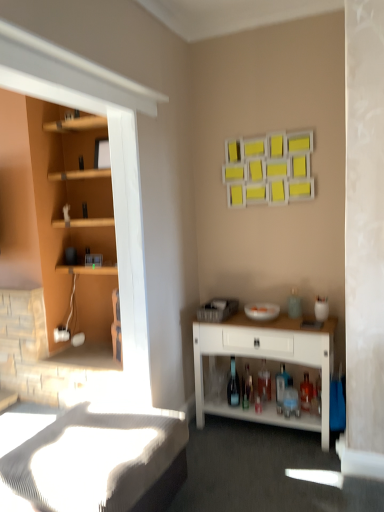
Describe the element at coordinates (99, 461) in the screenshot. I see `white textured bed frame at lower left` at that location.

The width and height of the screenshot is (384, 512). I want to click on white wood desk at lower right, so click(267, 359).

From the picture: Measure the distance between translucent glass bottle at lower center, the second bottle positioned from the left, and camera.

translucent glass bottle at lower center, the second bottle positioned from the left, is 9.23 feet away from camera.

You are a GUI agent. You are given a task and a screenshot of the screen. Output one action in this format:
    pyautogui.click(x=<x>, y=<y>)
    Task: Click on the transparent glass bottle at center, the 1th bottle positioned from the left
    This screenshot has width=384, height=512.
    Given the screenshot: What is the action you would take?
    pyautogui.click(x=233, y=386)

The image size is (384, 512). What do you see at coordinates (264, 383) in the screenshot?
I see `translucent glass bottle at lower center, which is the 3th bottle in left-to-right order` at bounding box center [264, 383].

What is the approximate width of translucent glass bottle at lower center, which is the 3th bottle in left-to-right order?

translucent glass bottle at lower center, which is the 3th bottle in left-to-right order, is 2.26 inches in width.

The width and height of the screenshot is (384, 512). What are the coordinates of `white textured bed frame at lower left` in the screenshot? It's located at (99, 461).

Does translucent glass bottle at lower center, the 2th bottle positioned from the right, turn towards translucent glass bottle at lower center, which is the 4th bottle in front-to-back order?

No, translucent glass bottle at lower center, the 2th bottle positioned from the right, is not oriented towards translucent glass bottle at lower center, which is the 4th bottle in front-to-back order.

Do you think translucent glass bottle at lower center, which is the second bottle from back to front, is within translucent glass bottle at lower center, which is the 4th bottle in front-to-back order, or outside of it?

translucent glass bottle at lower center, which is the second bottle from back to front, is not enclosed by translucent glass bottle at lower center, which is the 4th bottle in front-to-back order.

Is translucent glass bottle at lower center, the 2th bottle positioned from the right, not close to translucent glass bottle at lower center, placed as the 3th bottle when sorted from right to left?

No, translucent glass bottle at lower center, the 2th bottle positioned from the right, is not far away from translucent glass bottle at lower center, placed as the 3th bottle when sorted from right to left.

Is translucent glass bottle at lower center, which is the second bottle from back to front, at the right side of translucent glass bottle at lower center, placed as the 3th bottle when sorted from right to left?

Correct, you'll find translucent glass bottle at lower center, which is the second bottle from back to front, to the right of translucent glass bottle at lower center, placed as the 3th bottle when sorted from right to left.

Which object is more forward, translucent glass bottle at lower center, which is the second bottle from back to front, or translucent glass bottle at lower center, marked as the fourth bottle in a back-to-front arrangement?

translucent glass bottle at lower center, marked as the fourth bottle in a back-to-front arrangement, is in front.

From the image's perspective, is translucent glass bottle at lower center, which is the second bottle from back to front, positioned above or below translucent glass bottle at lower center, arranged as the first bottle when viewed from the right?

translucent glass bottle at lower center, which is the second bottle from back to front, is situated higher than translucent glass bottle at lower center, arranged as the first bottle when viewed from the right, in the image.

From a real-world perspective, does translucent glass bottle at lower center, which is the 3th bottle in left-to-right order, stand above translucent glass bottle at lower center, arranged as the first bottle when viewed from the right?

Correct, in the physical world, translucent glass bottle at lower center, which is the 3th bottle in left-to-right order, is higher than translucent glass bottle at lower center, arranged as the first bottle when viewed from the right.

Considering the sizes of objects translucent glass bottle at lower center, which is the second bottle from back to front, and translucent glass bottle at lower center, arranged as the first bottle when viewed from the right, in the image provided, who is wider, translucent glass bottle at lower center, which is the second bottle from back to front, or translucent glass bottle at lower center, arranged as the first bottle when viewed from the right,?

With larger width is translucent glass bottle at lower center, arranged as the first bottle when viewed from the right.

Is translucent glass bottle at lower center, arranged as the first bottle when viewed from the right, completely or partially outside of translucent glass bottle at lower center, which is the 3th bottle in left-to-right order?

translucent glass bottle at lower center, arranged as the first bottle when viewed from the right, is positioned outside translucent glass bottle at lower center, which is the 3th bottle in left-to-right order.

Considering the relative sizes of translucent glass bottle at lower center, arranged as the first bottle when viewed from the right, and translucent glass bottle at lower center, the 2th bottle positioned from the right, in the image provided, is translucent glass bottle at lower center, arranged as the first bottle when viewed from the right, shorter than translucent glass bottle at lower center, the 2th bottle positioned from the right,?

Yes.

You are a GUI agent. You are given a task and a screenshot of the screen. Output one action in this format:
    pyautogui.click(x=<x>, y=<y>)
    Task: Click on the 2nd bottle in front of the translucent glass bottle at lower center, which is the 3th bottle in left-to-right order, starting your count from the anchor
    
    Given the screenshot: What is the action you would take?
    pyautogui.click(x=290, y=401)

From a real-world perspective, which bottle is the 2nd one underneath the white wood desk at lower right? Please provide its 2D coordinates.

[(264, 383)]

From the image's perspective, is white wood desk at lower right positioned above or below translucent glass bottle at lower center, which appears as the 3th bottle when viewed from the front?

white wood desk at lower right is above translucent glass bottle at lower center, which appears as the 3th bottle when viewed from the front.

Considering the relative sizes of white wood desk at lower right and translucent glass bottle at lower center, which is the second bottle from back to front, in the image provided, is white wood desk at lower right thinner than translucent glass bottle at lower center, which is the second bottle from back to front,?

In fact, white wood desk at lower right might be wider than translucent glass bottle at lower center, which is the second bottle from back to front.

Can you confirm if white wood desk at lower right is taller than translucent glass bottle at lower center, which is the second bottle from back to front?

Correct, white wood desk at lower right is much taller as translucent glass bottle at lower center, which is the second bottle from back to front.

Is translucent glass bottle at lower center, the 4th bottle when ordered from left to right, taller or shorter than white textured bed frame at lower left?

Clearly, translucent glass bottle at lower center, the 4th bottle when ordered from left to right, is shorter compared to white textured bed frame at lower left.

Which object is wider, translucent glass bottle at lower center, the 4th bottle when ordered from left to right, or white textured bed frame at lower left?

white textured bed frame at lower left is wider.

Considering the positions of objects translucent glass bottle at lower center, marked as the fourth bottle in a back-to-front arrangement, and white textured bed frame at lower left in the image provided, who is more to the right, translucent glass bottle at lower center, marked as the fourth bottle in a back-to-front arrangement, or white textured bed frame at lower left?

translucent glass bottle at lower center, marked as the fourth bottle in a back-to-front arrangement.

Is translucent glass bottle at lower center, which appears as the 1th bottle when viewed from the front, far from white textured bed frame at lower left?

Yes, translucent glass bottle at lower center, which appears as the 1th bottle when viewed from the front, and white textured bed frame at lower left are located far from each other.

Does translucent glass bottle at lower center, which is the second bottle from back to front, have a greater height compared to transparent glass bottle at center, the 4th bottle positioned from the right?

Incorrect, the height of translucent glass bottle at lower center, which is the second bottle from back to front, is not larger of that of transparent glass bottle at center, the 4th bottle positioned from the right.

Would you say translucent glass bottle at lower center, which is the second bottle from back to front, is to the left or to the right of transparent glass bottle at center, placed as the third bottle when sorted from back to front, in the picture?

From the image, it's evident that translucent glass bottle at lower center, which is the second bottle from back to front, is to the right of transparent glass bottle at center, placed as the third bottle when sorted from back to front.

How many degrees apart are the facing directions of translucent glass bottle at lower center, the 2th bottle positioned from the right, and transparent glass bottle at center, the 4th bottle positioned from the right?

They differ by 7.22 degrees in their facing directions.

Would you say translucent glass bottle at lower center, the 2th bottle positioned from the right, contains transparent glass bottle at center, placed as the third bottle when sorted from back to front?

No, transparent glass bottle at center, placed as the third bottle when sorted from back to front, is not surrounded by translucent glass bottle at lower center, the 2th bottle positioned from the right.

Do you think white wood desk at lower right is within white textured bed frame at lower left, or outside of it?

white wood desk at lower right is outside white textured bed frame at lower left.

Who is smaller, white wood desk at lower right or white textured bed frame at lower left?

With smaller size is white textured bed frame at lower left.

In the image, is white wood desk at lower right on the left side or the right side of white textured bed frame at lower left?

Clearly, white wood desk at lower right is on the right of white textured bed frame at lower left in the image.

This screenshot has width=384, height=512. I want to click on bottle that is the 1st object located above the translucent glass bottle at lower center, placed as the 3th bottle when sorted from right to left (from the image's perspective), so click(264, 383).

Locate an element on the screen. bottle that is the 1st one above the translucent glass bottle at lower center, the 4th bottle when ordered from left to right (from a real-world perspective) is located at coordinates (264, 383).

Which object lies further to the anchor point translucent glass bottle at lower center, the 4th bottle when ordered from left to right, white wood desk at lower right or translucent glass bottle at lower center, which appears as the 3th bottle when viewed from the front?

Among the two, white wood desk at lower right is located further to translucent glass bottle at lower center, the 4th bottle when ordered from left to right.

Estimate the real-world distances between objects in this image. Which object is closer to translucent glass bottle at lower center, which appears as the 3th bottle when viewed from the front, translucent glass bottle at lower center, arranged as the 1th bottle when viewed from the back, or white textured bed frame at lower left?

translucent glass bottle at lower center, arranged as the 1th bottle when viewed from the back, is closer to translucent glass bottle at lower center, which appears as the 3th bottle when viewed from the front.

Based on their spatial positions, is translucent glass bottle at lower center, the second bottle positioned from the left, or translucent glass bottle at lower center, the 2th bottle positioned from the right, further from white wood desk at lower right?

The object further to white wood desk at lower right is translucent glass bottle at lower center, the second bottle positioned from the left.

Looking at the image, which one is located further to translucent glass bottle at lower center, the 2th bottle positioned from the right, white textured bed frame at lower left or transparent glass bottle at center, the 1th bottle positioned from the left?

Among the two, white textured bed frame at lower left is located further to translucent glass bottle at lower center, the 2th bottle positioned from the right.

Looking at the image, which one is located further to white wood desk at lower right, translucent glass bottle at lower center, which is the 3th bottle in left-to-right order, or white textured bed frame at lower left?

white textured bed frame at lower left lies further to white wood desk at lower right than the other object.

From the image, which object appears to be nearer to white wood desk at lower right, translucent glass bottle at lower center, which is the 3th bottle in left-to-right order, or translucent glass bottle at lower center, marked as the fourth bottle in a back-to-front arrangement?

translucent glass bottle at lower center, which is the 3th bottle in left-to-right order, lies closer to white wood desk at lower right than the other object.

In the scene shown: Estimate the real-world distances between objects in this image. Which object is further from translucent glass bottle at lower center, arranged as the first bottle when viewed from the right, translucent glass bottle at lower center, which is the 3th bottle in left-to-right order, or translucent glass bottle at lower center, placed as the 3th bottle when sorted from right to left?

Based on the image, translucent glass bottle at lower center, placed as the 3th bottle when sorted from right to left, appears to be further to translucent glass bottle at lower center, arranged as the first bottle when viewed from the right.

Based on their spatial positions, is white textured bed frame at lower left or transparent glass bottle at center, the 4th bottle positioned from the right, closer to translucent glass bottle at lower center, the second bottle positioned from the left?

Among the two, transparent glass bottle at center, the 4th bottle positioned from the right, is located nearer to translucent glass bottle at lower center, the second bottle positioned from the left.

Image resolution: width=384 pixels, height=512 pixels. I want to click on desk between white textured bed frame at lower left and transparent glass bottle at center, the 1th bottle positioned from the left, from front to back, so click(x=267, y=359).

Find the location of `bottle between white textured bed frame at lower left and transparent glass bottle at center, the 4th bottle positioned from the right, along the z-axis`. bottle between white textured bed frame at lower left and transparent glass bottle at center, the 4th bottle positioned from the right, along the z-axis is located at coordinates (290, 401).

You are a GUI agent. You are given a task and a screenshot of the screen. Output one action in this format:
    pyautogui.click(x=<x>, y=<y>)
    Task: Click on the desk located between white textured bed frame at lower left and translucent glass bottle at lower center, placed as the 3th bottle when sorted from right to left, in the depth direction
    
    Given the screenshot: What is the action you would take?
    pyautogui.click(x=267, y=359)

Locate an element on the screen. The width and height of the screenshot is (384, 512). desk between white textured bed frame at lower left and translucent glass bottle at lower center, which is the 3th bottle in left-to-right order, from front to back is located at coordinates (267, 359).